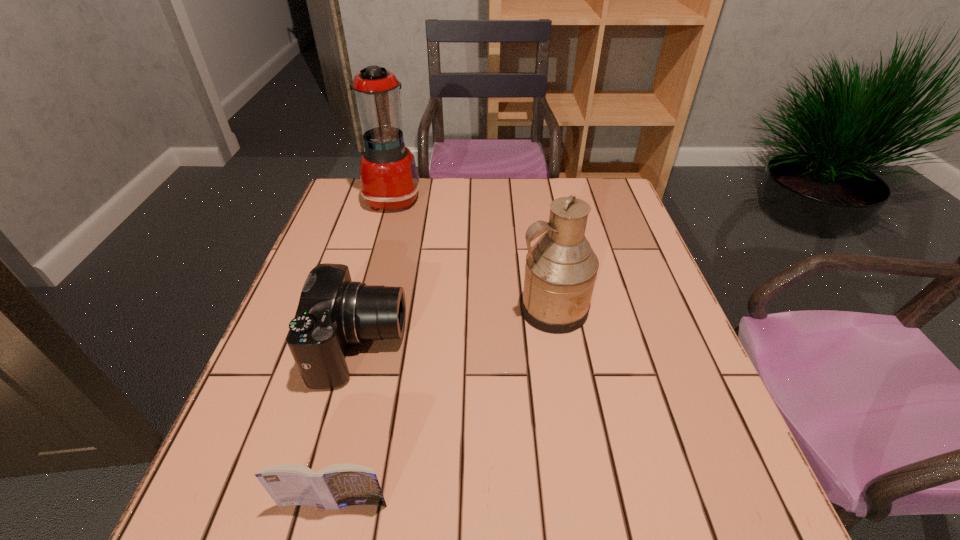
Where is `free location that satisfies the following two spatial constraints: 1. on the controls of the rightmost object; 2. on the left side of the tallest object`? The height and width of the screenshot is (540, 960). free location that satisfies the following two spatial constraints: 1. on the controls of the rightmost object; 2. on the left side of the tallest object is located at coordinates (363, 309).

At what (x,y) coordinates should I click in order to perform the action: click on blank space that satisfies the following two spatial constraints: 1. on the back side of the pitcher; 2. on the controls of the tallest object. Please return your answer as a coordinate pair (x, y). This screenshot has height=540, width=960. Looking at the image, I should click on [x=534, y=198].